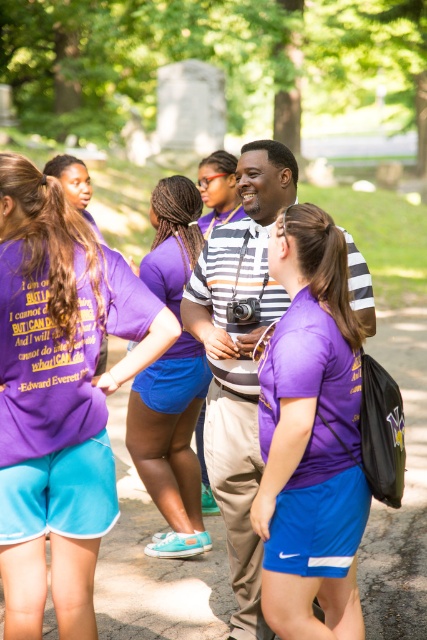
Between point (230, 204) and point (102, 339), which one is positioned behind?

The point (230, 204) is behind.

Based on the photo, which is more to the left, matte purple shirt at center or purple cotton shirt at center?

purple cotton shirt at center

Which is in front, point (201, 164) or point (49, 166)?

Point (49, 166)

At what (x,y) coordinates should I click in order to perform the action: click on matte purple shirt at center. Please return your answer as a coordinate pair (x, y). This screenshot has height=640, width=427. Looking at the image, I should click on (218, 189).

Can you confirm if striped fabric camera at center is positioned above purple cotton shirt at center?

Actually, striped fabric camera at center is below purple cotton shirt at center.

This screenshot has height=640, width=427. What do you see at coordinates (239, 358) in the screenshot? I see `striped fabric camera at center` at bounding box center [239, 358].

Is point (184, 316) in front of point (90, 180)?

Yes, point (184, 316) is closer to viewer.

What are the coordinates of `striped fabric camera at center` in the screenshot? It's located at (239, 358).

Is striped fabric camera at center above purple fabric shorts at center?

No.

Is point (246, 195) less distant than point (175, 260)?

Yes, point (246, 195) is closer to viewer.

Find the location of a particular element. striped fabric camera at center is located at coordinates (239, 358).